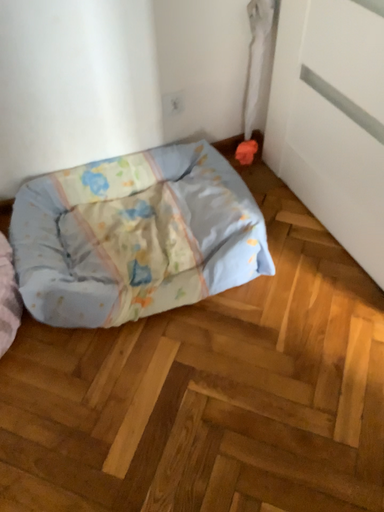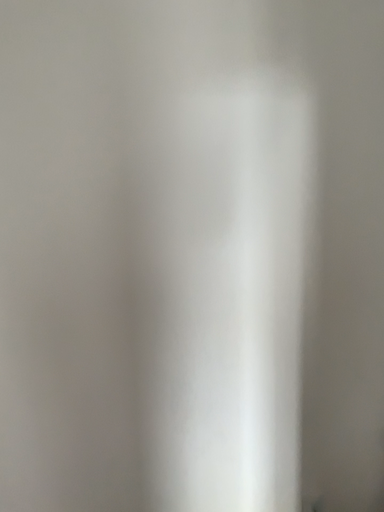
Question: How did the camera likely rotate when shooting the video?

Choices:
 (A) rotated right
 (B) rotated left

Answer: (B)